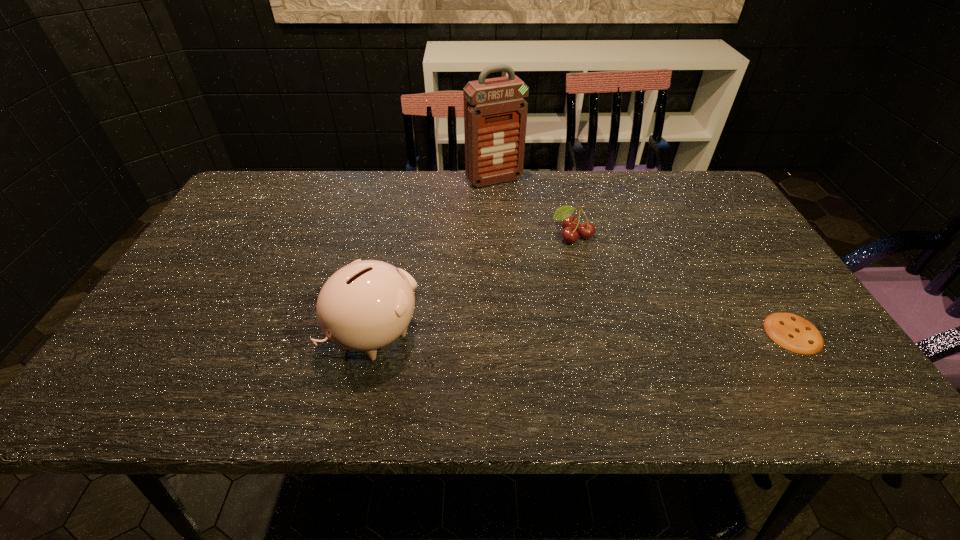
I want to click on vacant space that satisfies the following two spatial constraints: 1. on the front side of the shortest object; 2. on the left side of the third tallest object, so click(x=595, y=333).